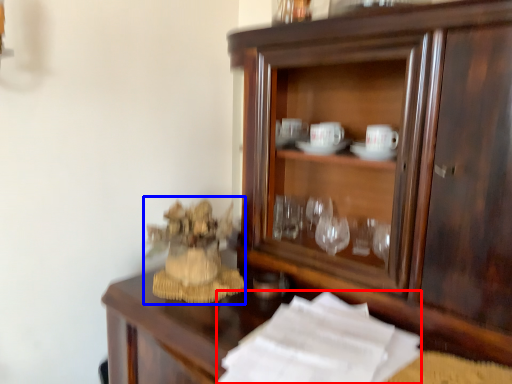
Question: Which of the following is the farthest to the observer, paper (highlighted by a red box) or toy (highlighted by a blue box)?

Choices:
 (A) paper
 (B) toy

Answer: (B)